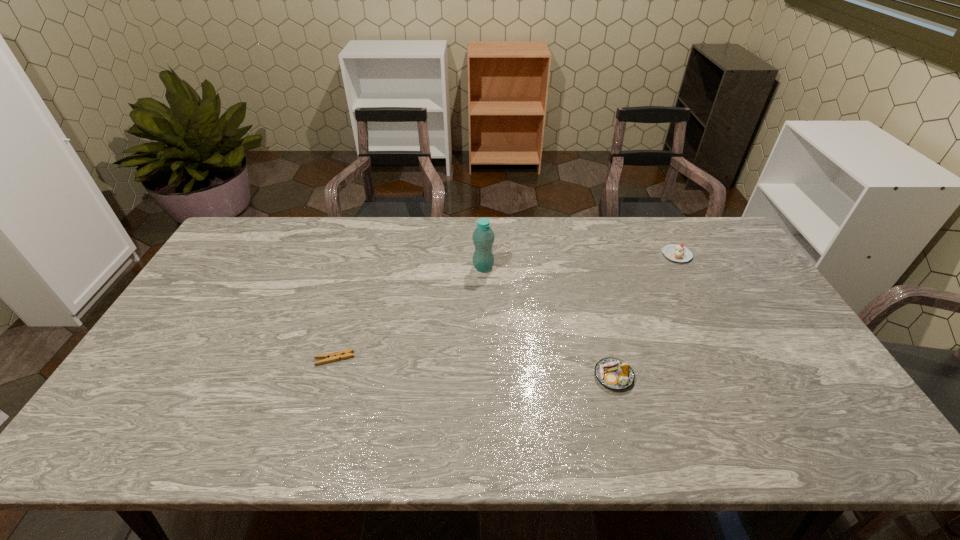
I want to click on free area in between the cupcake and the leftmost object, so click(506, 307).

You are a GUI agent. You are given a task and a screenshot of the screen. Output one action in this format:
    pyautogui.click(x=<x>, y=<y>)
    Task: Click on the empty space between the clothespin and the rightmost object
    
    Given the screenshot: What is the action you would take?
    pyautogui.click(x=506, y=307)

The height and width of the screenshot is (540, 960). Find the location of `free space between the second object from right to left and the cupcake`. free space between the second object from right to left and the cupcake is located at coordinates (645, 315).

Identify the location of vacant space in between the rightmost object and the tallest object. This screenshot has width=960, height=540. (580, 261).

At what (x,y) coordinates should I click in order to perform the action: click on free space between the cupcake and the pastry. Please return your answer as a coordinate pair (x, y). Looking at the image, I should click on (645, 315).

Where is `vacant region between the cupcake and the second object from left to right`? The height and width of the screenshot is (540, 960). vacant region between the cupcake and the second object from left to right is located at coordinates (580, 261).

Identify the location of blank region between the tallest object and the rightmost object. This screenshot has height=540, width=960. (580, 261).

Image resolution: width=960 pixels, height=540 pixels. I want to click on free spot between the second object from right to left and the tallest object, so click(x=548, y=322).

Image resolution: width=960 pixels, height=540 pixels. Identify the location of the third closest object relative to the shortest object. (675, 252).

At what (x,y) coordinates should I click in order to perform the action: click on the closest object relative to the shortest object. Please return your answer as a coordinate pair (x, y). Looking at the image, I should click on (483, 237).